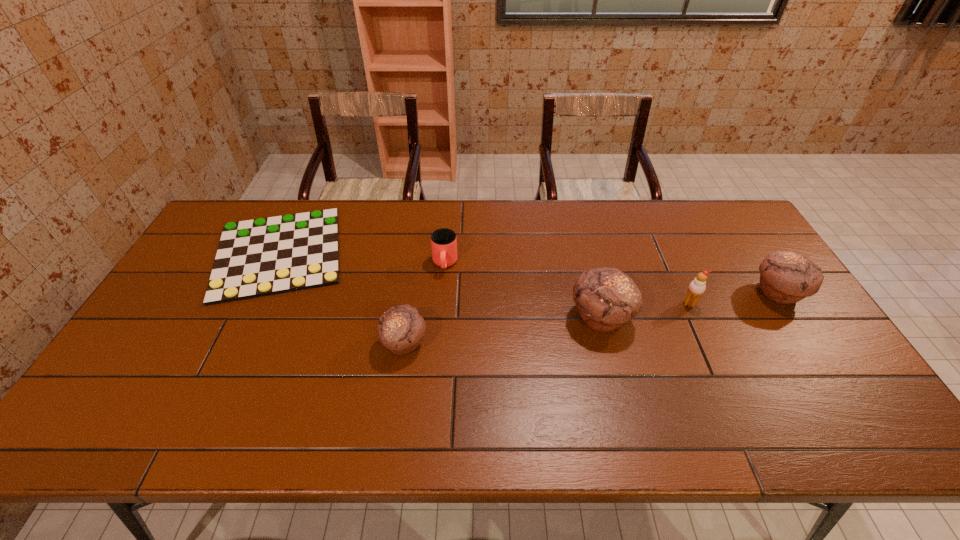
Where is `vacant space at the left edge of the desktop`? This screenshot has width=960, height=540. vacant space at the left edge of the desktop is located at coordinates click(x=187, y=272).

Locate an element on the screen. vacant space at the right edge of the desktop is located at coordinates (715, 244).

In the image, there is a desktop. At what (x,y) coordinates should I click in order to perform the action: click on blank space at the far left corner. Please return your answer as a coordinate pair (x, y). The width and height of the screenshot is (960, 540). Looking at the image, I should click on (251, 206).

The image size is (960, 540). In the image, there is a desktop. Find the location of `vacant space at the near left corner`. vacant space at the near left corner is located at coordinates [x=170, y=391].

The width and height of the screenshot is (960, 540). What are the coordinates of `free space at the far right corner` in the screenshot? It's located at (698, 205).

Identify the location of vacant space at the near right corner of the desktop. The width and height of the screenshot is (960, 540). (847, 374).

Locate an element on the screen. This screenshot has height=540, width=960. vacant area that lies between the third object from right to left and the shortest object is located at coordinates (440, 285).

At what (x,y) coordinates should I click in order to perform the action: click on blank region between the second muffin from right to left and the fifth object from left to right. Please return your answer as a coordinate pair (x, y). Image resolution: width=960 pixels, height=540 pixels. Looking at the image, I should click on (645, 310).

This screenshot has height=540, width=960. I want to click on unoccupied area between the second muffin from right to left and the leftmost object, so click(440, 285).

The image size is (960, 540). In order to click on empty space between the second shortest muffin and the icecream in this screenshot , I will do `click(733, 298)`.